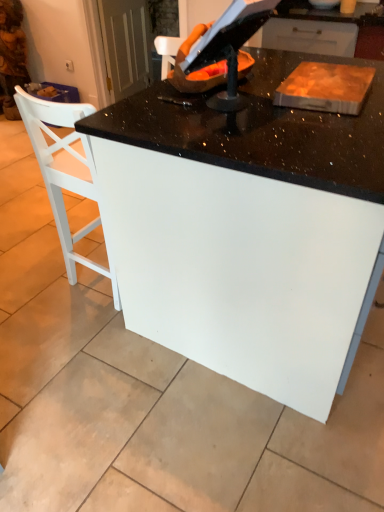
Question: From a real-world perspective, is white wooden chair at left physically located above or below white glossy table at center?

Choices:
 (A) below
 (B) above

Answer: (B)

Question: Relative to white glossy table at center, is white wooden chair at left in front or behind?

Choices:
 (A) behind
 (B) front

Answer: (A)

Question: Is point (67, 146) closer or farther from the camera than point (286, 124)?

Choices:
 (A) closer
 (B) farther

Answer: (B)

Question: Is white glossy table at center inside the boundaries of white wooden chair at left, or outside?

Choices:
 (A) inside
 (B) outside

Answer: (B)

Question: Is point (112, 152) closer or farther from the camera than point (38, 112)?

Choices:
 (A) farther
 (B) closer

Answer: (B)

Question: Visually, is white glossy table at center positioned to the left or to the right of white wooden chair at left?

Choices:
 (A) left
 (B) right

Answer: (B)

Question: From their relative heights in the image, would you say white glossy table at center is taller or shorter than white wooden chair at left?

Choices:
 (A) tall
 (B) short

Answer: (B)